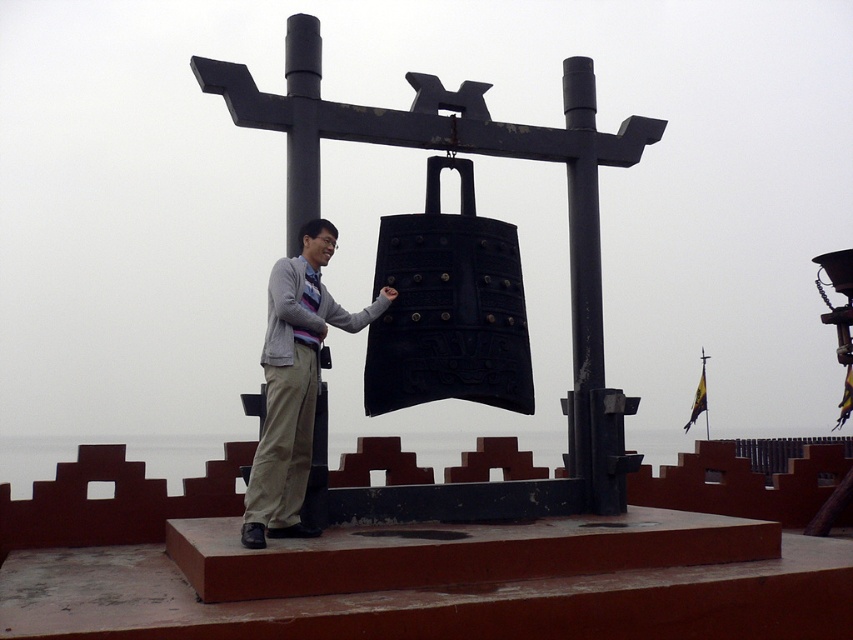
Question: Is black metal bell at center wider than light beige pants at center?

Choices:
 (A) no
 (B) yes

Answer: (B)

Question: Among these objects, which one is nearest to the camera?

Choices:
 (A) light beige pants at center
 (B) black metal bell at center

Answer: (A)

Question: Considering the relative positions of black metal bell at center and light beige pants at center in the image provided, where is black metal bell at center located with respect to light beige pants at center?

Choices:
 (A) left
 (B) right

Answer: (B)

Question: Which of the following is the closest to the observer?

Choices:
 (A) black metal bell at center
 (B) light beige pants at center

Answer: (B)

Question: Is black metal bell at center positioned at the back of light beige pants at center?

Choices:
 (A) no
 (B) yes

Answer: (B)